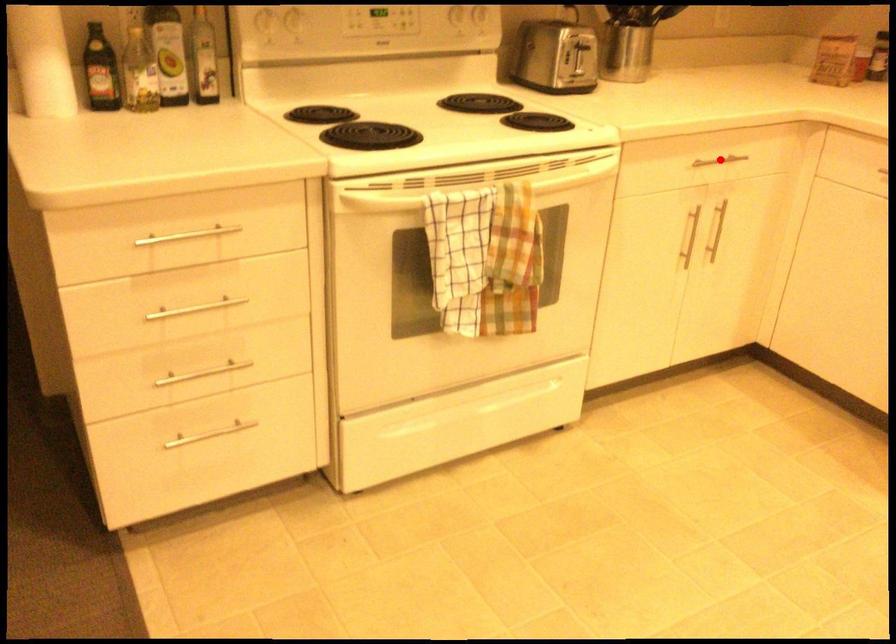
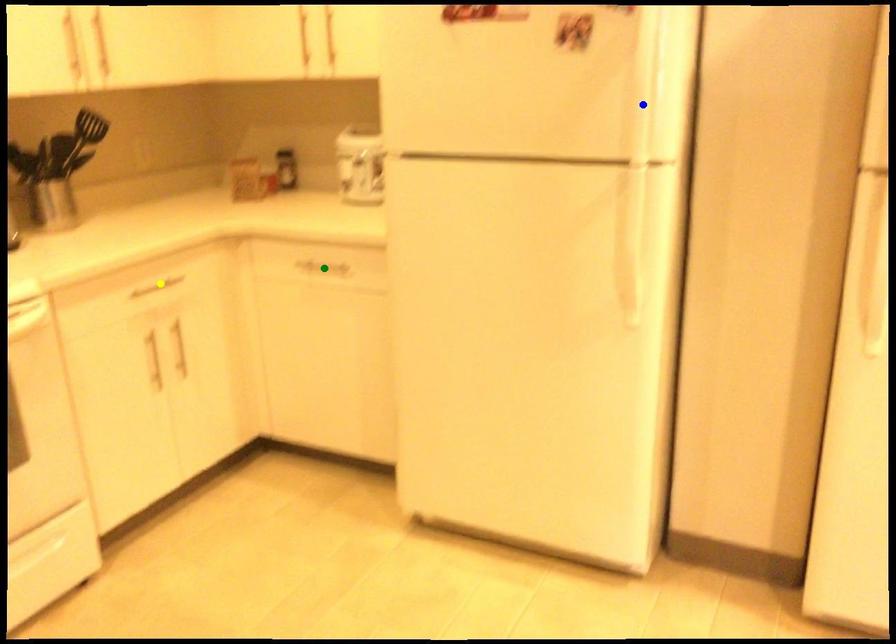
Question: I am providing you with two images of the same scene from different viewpoints. A red point is marked on the first image. You are given multiple points on the second image. Which spot in image 2 lines up with the point in image 1?

Choices:
 (A) blue point
 (B) green point
 (C) yellow point

Answer: (C)